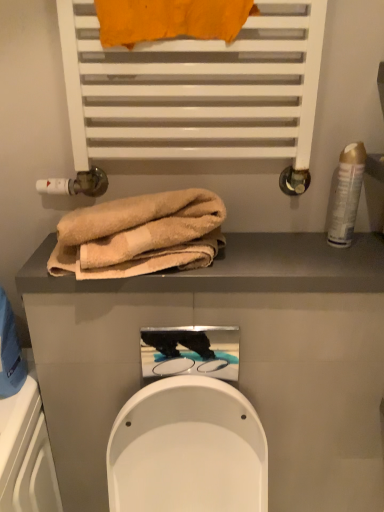
The height and width of the screenshot is (512, 384). What are the coordinates of `vacant space in front of gold metallic can at right` in the screenshot? It's located at (344, 265).